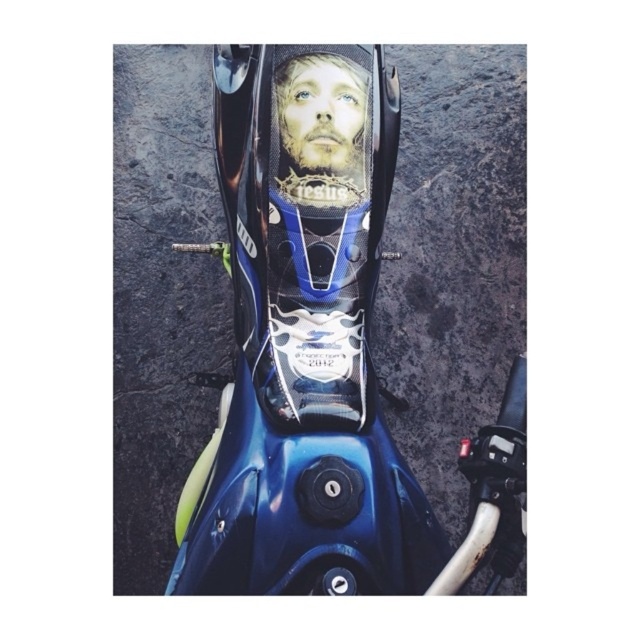
You are a photographer trying to capture both the glossy carbon fiber motorcycle at center and the smooth skin face at center in a single frame. Since the motorcycle is taller, where should you position the camera to ensure both subjects are fully visible?

To ensure both the glossy carbon fiber motorcycle at center and the smooth skin face at center are fully visible in the frame, position the camera at a lower angle so that the taller motorcycle doesn doesn block the view of the smooth skin face at center.

You are a photographer trying to capture the motorcycle fuel tank. You have two points marked on your viewfinder at coordinates point (328,304) and point (353,131). Which point is closer to you?

Point (328,304) is closer to the viewer than point (353,131).

You are standing in front of a motorcycle. Where is the glossy carbon fiber motorcycle at center located in the image?

The glossy carbon fiber motorcycle at center is located at point (323, 378).